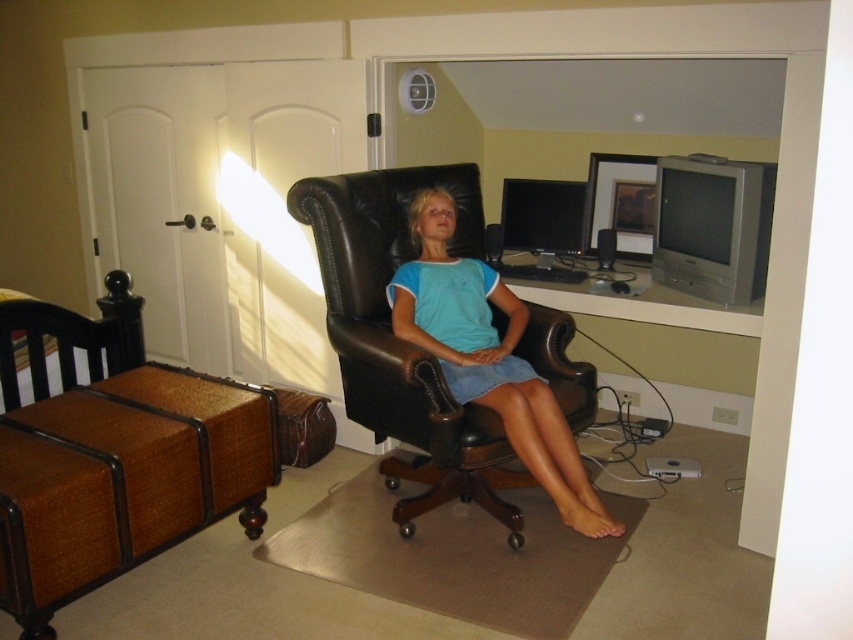
Question: Is matte black computer desk at upper right in front of matte black monitor at upper right?

Choices:
 (A) no
 (B) yes

Answer: (B)

Question: Which object is farther from the camera taking this photo?

Choices:
 (A) matte black monitor at upper right
 (B) silver metallic television at upper right

Answer: (A)

Question: Does silver metallic television at upper right appear on the left side of matte black monitor at upper right?

Choices:
 (A) yes
 (B) no

Answer: (B)

Question: Which object is the farthest from the matte black computer desk at upper right?

Choices:
 (A) brown wicker swivel chair at left
 (B) matte black monitor at upper right
 (C) matte blue shirt at center

Answer: (A)

Question: Which point is farther to the camera?

Choices:
 (A) matte black computer desk at upper right
 (B) matte blue shirt at center
 (C) silver metallic television at upper right
 (D) matte black monitor at upper right

Answer: (D)

Question: Is matte black computer desk at upper right bigger than matte black monitor at upper right?

Choices:
 (A) no
 (B) yes

Answer: (B)